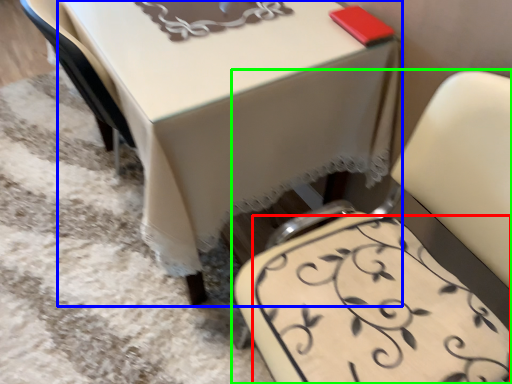
Question: Which object is the farthest from design (highlighted by a red box)? Choose among these: table (highlighted by a blue box) or chair (highlighted by a green box).

Choices:
 (A) table
 (B) chair

Answer: (A)